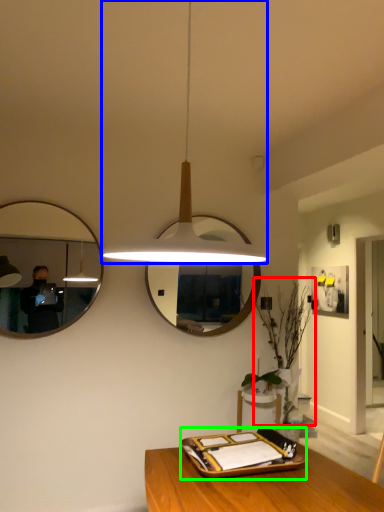
Question: Which object is positioned closest to plant (highlighted by a red box)? Select from lamp (highlighted by a blue box) and tray (highlighted by a green box).

Choices:
 (A) lamp
 (B) tray

Answer: (B)